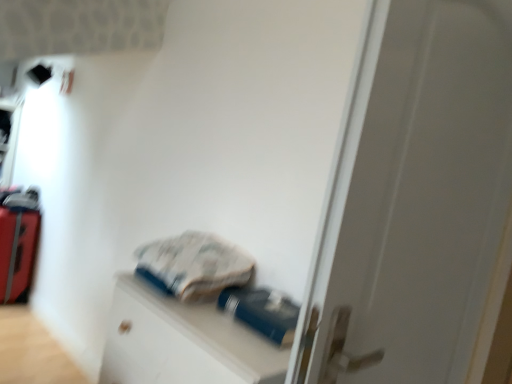
Question: Is red suitcase at left located outside blue rubberized bottle at center?

Choices:
 (A) no
 (B) yes

Answer: (B)

Question: Would you consider red suitcase at left to be distant from blue rubberized bottle at center?

Choices:
 (A) no
 (B) yes

Answer: (B)

Question: Does red suitcase at left have a lesser width compared to blue rubberized bottle at center?

Choices:
 (A) no
 (B) yes

Answer: (A)

Question: Is red suitcase at left beside blue rubberized bottle at center?

Choices:
 (A) yes
 (B) no

Answer: (B)

Question: Considering the relative sizes of red suitcase at left and blue rubberized bottle at center in the image provided, is red suitcase at left taller than blue rubberized bottle at center?

Choices:
 (A) no
 (B) yes

Answer: (B)

Question: Looking at the image, does red suitcase at left seem bigger or smaller compared to white matte door at center?

Choices:
 (A) big
 (B) small

Answer: (B)

Question: From the image's perspective, is red suitcase at left located above or below white matte door at center?

Choices:
 (A) below
 (B) above

Answer: (A)

Question: Relative to white matte door at center, is red suitcase at left in front or behind?

Choices:
 (A) behind
 (B) front

Answer: (A)

Question: Is red suitcase at left to the left or to the right of white matte door at center in the image?

Choices:
 (A) left
 (B) right

Answer: (A)

Question: Is point (133, 344) closer or farther from the camera than point (458, 271)?

Choices:
 (A) closer
 (B) farther

Answer: (B)

Question: Is blue matte file cabinet at center in front of or behind white matte door at center in the image?

Choices:
 (A) behind
 (B) front

Answer: (A)

Question: In terms of size, does blue matte file cabinet at center appear bigger or smaller than white matte door at center?

Choices:
 (A) big
 (B) small

Answer: (B)

Question: Considering the relative positions of blue matte file cabinet at center and white matte door at center in the image provided, is blue matte file cabinet at center to the left or to the right of white matte door at center?

Choices:
 (A) right
 (B) left

Answer: (B)

Question: Would you say blue matte file cabinet at center is inside or outside red suitcase at left?

Choices:
 (A) inside
 (B) outside

Answer: (B)

Question: Considering the relative positions of blue matte file cabinet at center and red suitcase at left in the image provided, is blue matte file cabinet at center to the left or to the right of red suitcase at left?

Choices:
 (A) left
 (B) right

Answer: (B)